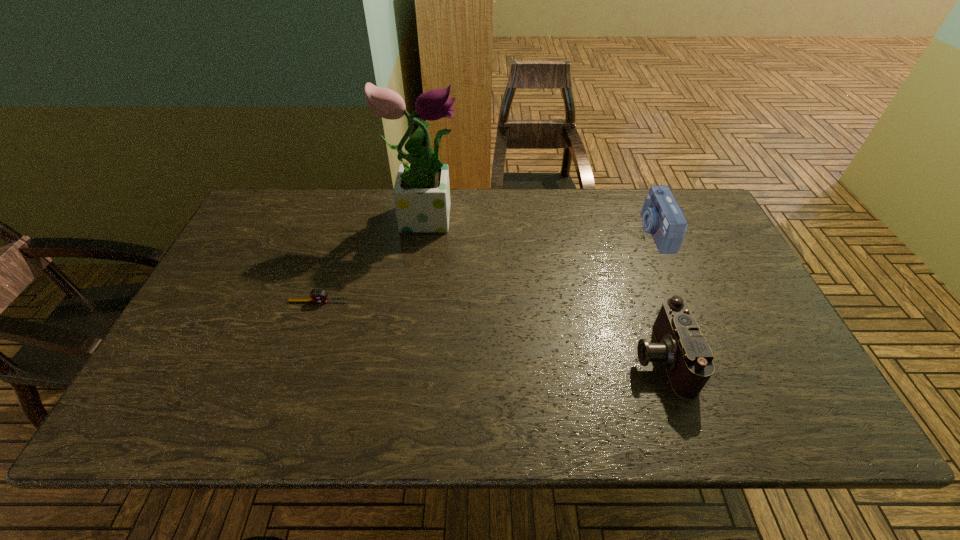
Where is `flower arrangement`? The height and width of the screenshot is (540, 960). flower arrangement is located at coordinates tap(421, 193).

Where is `the second object from left to right`? This screenshot has width=960, height=540. the second object from left to right is located at coordinates (421, 193).

At what (x,y) coordinates should I click in order to perform the action: click on the right camera. Please return your answer as a coordinate pair (x, y). Looking at the image, I should click on (662, 217).

This screenshot has width=960, height=540. In order to click on the farther camera in this screenshot , I will do `click(662, 217)`.

Locate an element on the screen. the left camera is located at coordinates (686, 354).

This screenshot has height=540, width=960. I want to click on the second object from right to left, so (x=686, y=354).

Identify the location of the leftmost object. (317, 296).

At what (x,y) coordinates should I click in order to perform the action: click on tape measure. Please return your answer as a coordinate pair (x, y). The width and height of the screenshot is (960, 540). Looking at the image, I should click on (317, 296).

At what (x,y) coordinates should I click in order to perform the action: click on vacant space located on the front-facing side of the tallest object. Please return your answer as a coordinate pair (x, y). Image resolution: width=960 pixels, height=540 pixels. Looking at the image, I should click on (564, 215).

This screenshot has height=540, width=960. In order to click on free space located 0.110m on the lens of the rightmost object in this screenshot , I will do `click(607, 232)`.